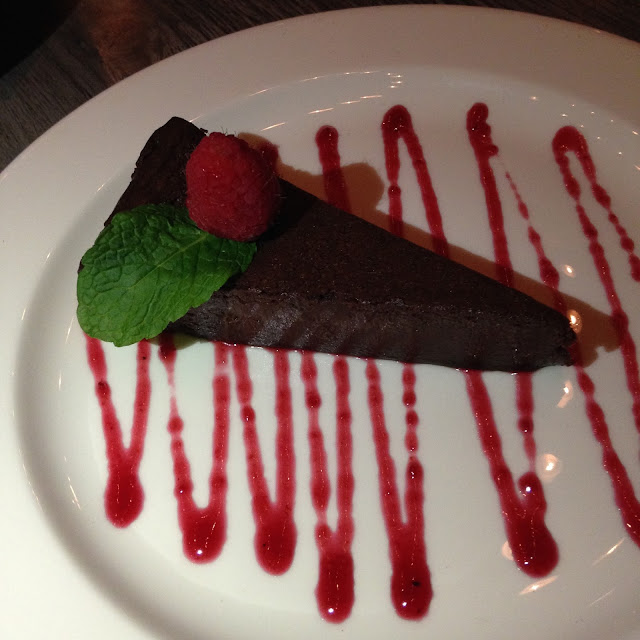
The height and width of the screenshot is (640, 640). What are the coordinates of `decorations` in the screenshot? It's located at (413, 538).